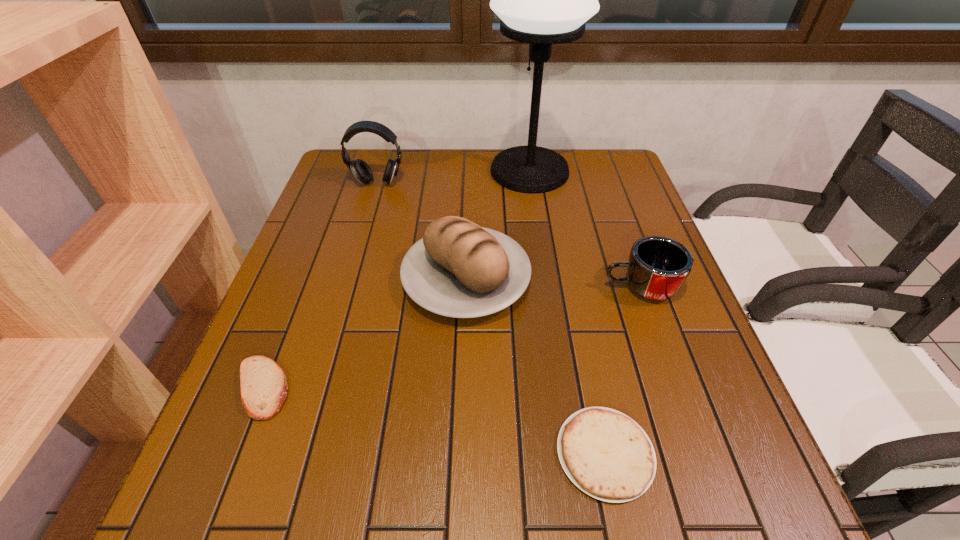
I want to click on vacant region between the tortilla and the fourth tallest object, so click(x=622, y=370).

Where is `free point between the pita bread and the tallest object`? free point between the pita bread and the tallest object is located at coordinates (396, 280).

Locate an element on the screen. This screenshot has width=960, height=540. vacant space in between the table lamp and the third shortest object is located at coordinates (585, 230).

Where is `vacant space in between the pita bread and the fourth tallest object`? The height and width of the screenshot is (540, 960). vacant space in between the pita bread and the fourth tallest object is located at coordinates (451, 338).

Image resolution: width=960 pixels, height=540 pixels. Identify the location of free space that is in between the fourth tallest object and the pita bread. (451, 338).

Identify the location of free space between the tortilla and the table lamp. The image size is (960, 540). (567, 312).

Choose which object is the fifth nearest neighbor to the pita bread. Please provide its 2D coordinates. Your answer should be formatted as a tuple, i.e. [(x, y)], where the tuple contains the x and y coordinates of a point satisfying the conditions above.

[(542, 0)]

Identify which object is the fourth nearest to the earphone. Please provide its 2D coordinates. Your answer should be formatted as a tuple, i.e. [(x, y)], where the tuple contains the x and y coordinates of a point satisfying the conditions above.

[(658, 266)]

At what (x,y) coordinates should I click in order to perform the action: click on vacant region that satisfies the following two spatial constraints: 1. on the ear cups of the second tallest object; 2. on the right side of the tortilla. Please return your answer as a coordinate pair (x, y). The height and width of the screenshot is (540, 960). Looking at the image, I should click on (298, 453).

Where is `free point that satisfies the following two spatial constraints: 1. on the back side of the bread; 2. on the right side of the tallest object`? free point that satisfies the following two spatial constraints: 1. on the back side of the bread; 2. on the right side of the tallest object is located at coordinates (469, 171).